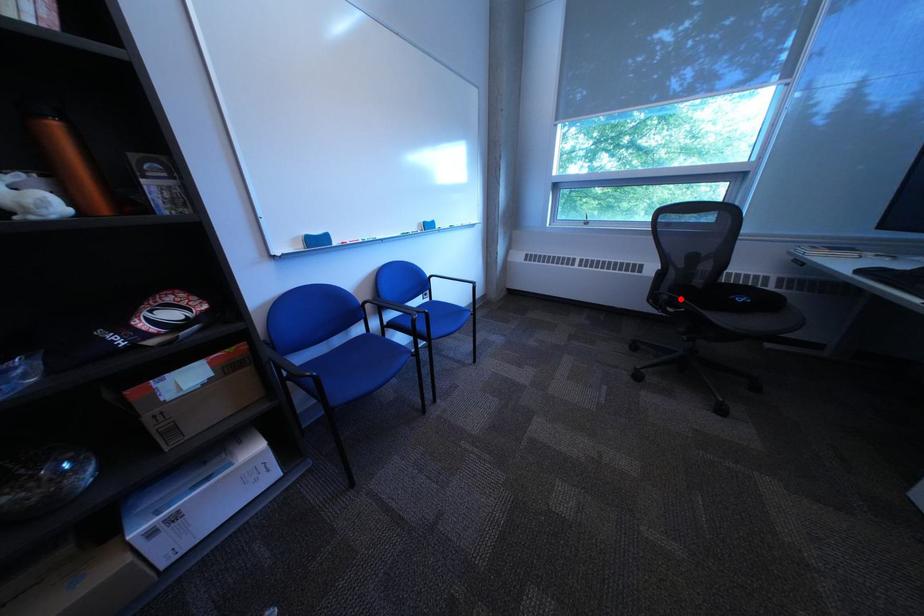
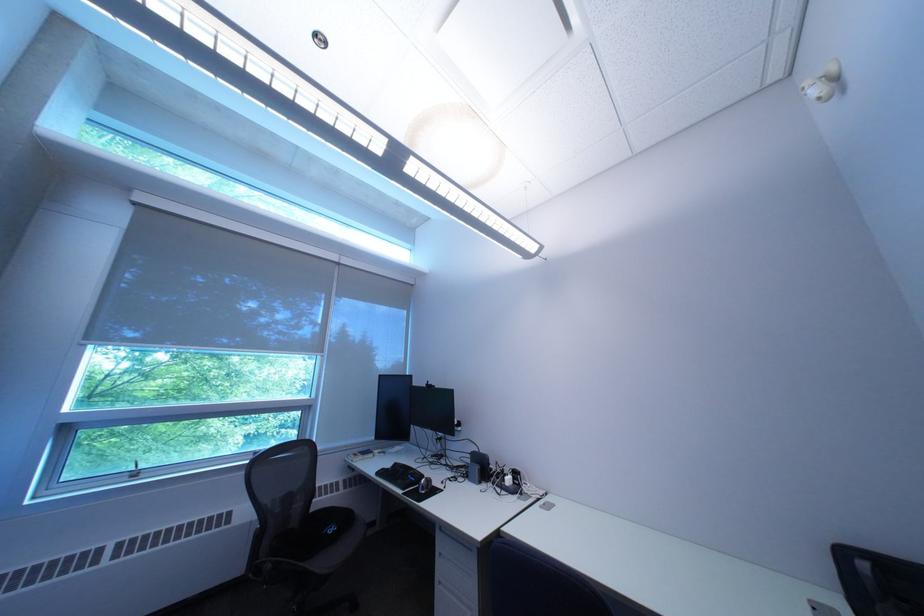
In the second image, find the point that corresponds to the highlighted location in the first image.

(285, 568)